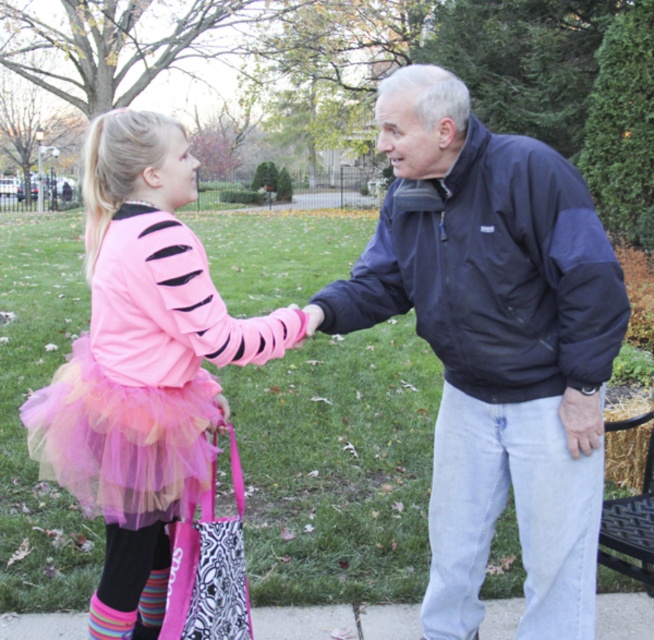
Question: Among these points, which one is nearest to the camera?

Choices:
 (A) (182, 632)
 (B) (88, 627)
 (C) (417, 608)

Answer: (A)

Question: Estimate the real-world distances between objects in this image. Which object is farther from the pink tulle skirt at left?

Choices:
 (A) pink fabric bag at lower center
 (B) smooth concrete pavement at lower center

Answer: (B)

Question: Considering the relative positions of pink tulle ballet skirt at lower left and striped wool sock at lower left in the image provided, where is pink tulle ballet skirt at lower left located with respect to striped wool sock at lower left?

Choices:
 (A) left
 (B) right

Answer: (B)

Question: Does navy blue jacket at center appear over striped wool sock at lower left?

Choices:
 (A) no
 (B) yes

Answer: (B)

Question: Among these objects, which one is farthest from the camera?

Choices:
 (A) smooth concrete pavement at lower center
 (B) pink tulle skirt at left
 (C) navy blue jacket at center
 (D) pink fabric bag at lower center

Answer: (A)

Question: In this image, where is pink tulle ballet skirt at lower left located relative to smooth concrete pavement at lower center?

Choices:
 (A) below
 (B) above

Answer: (B)